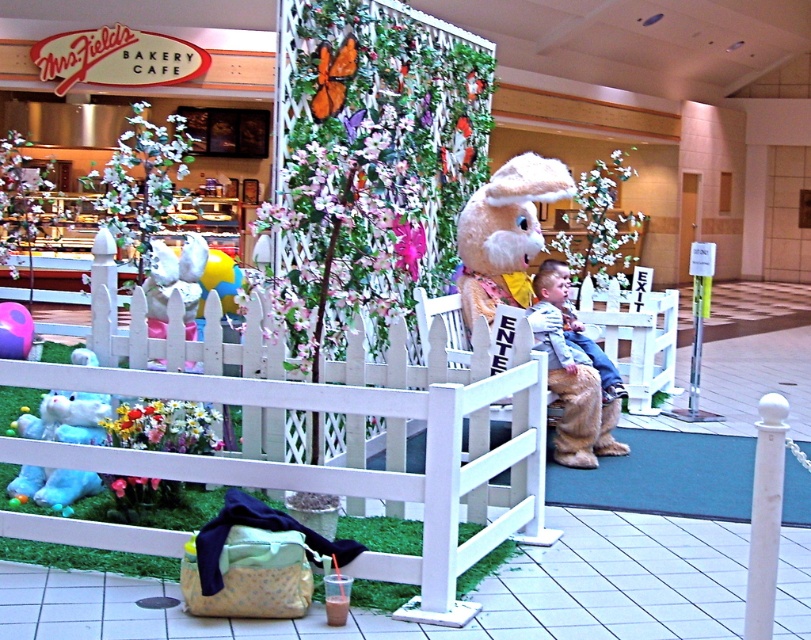
Question: Which point is closer to the camera taking this photo?

Choices:
 (A) (556, 275)
 (B) (586, 356)

Answer: (A)

Question: Is fluffy beige bunny at center to the right of light blue denim jeans at center from the viewer's perspective?

Choices:
 (A) yes
 (B) no

Answer: (B)

Question: Does fluffy beige bunny at center have a greater width compared to light blue denim jeans at center?

Choices:
 (A) no
 (B) yes

Answer: (B)

Question: Among these points, which one is nearest to the camera?

Choices:
 (A) (507, 298)
 (B) (618, 387)

Answer: (B)

Question: Among these points, which one is farthest from the camera?

Choices:
 (A) (563, 304)
 (B) (533, 156)

Answer: (B)

Question: Where is fluffy beige bunny at center located in relation to light blue denim jeans at center in the image?

Choices:
 (A) below
 (B) above

Answer: (B)